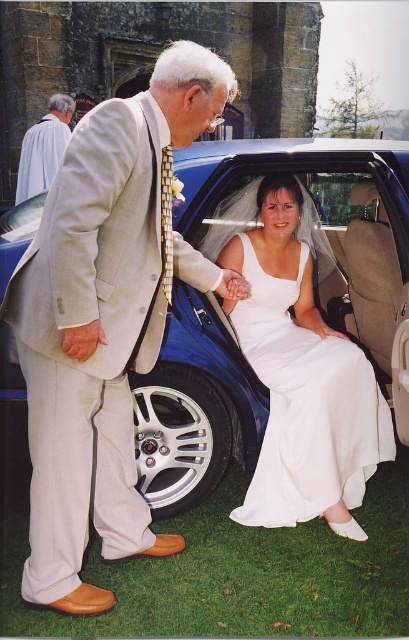
Who is higher up, blue metallic car at center or silver metallic tire at lower center?

blue metallic car at center is higher up.

Which is behind, point (166, 337) or point (150, 400)?

The point (150, 400) is behind.

Who is more distant from viewer, (x=231, y=342) or (x=166, y=461)?

Point (x=166, y=461)

Identify the location of blue metallic car at center. This screenshot has width=409, height=640. (318, 220).

Which is behind, point (193, 97) or point (262, 449)?

Positioned behind is point (262, 449).

Image resolution: width=409 pixels, height=640 pixels. In order to click on light beige suit at center in this screenshot , I will do `click(105, 320)`.

Can you confirm if light beige suit at center is shorter than light gray suit at upper left?

No.

Which is in front, point (42, 250) or point (29, 144)?

Point (42, 250) is more forward.

This screenshot has height=640, width=409. In order to click on light beige suit at center in this screenshot , I will do `click(105, 320)`.